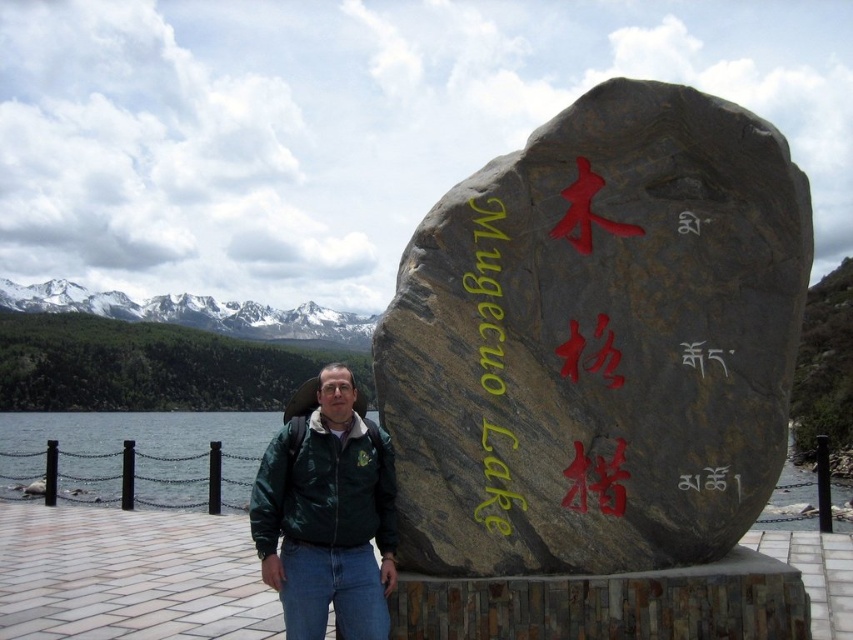
You are a photographer aiming to capture the man in the green matte jacket at center and the clear water at dock left in the same frame. Based on their positions, which object should you focus on first to ensure both are in the shot?

You should focus on the clear water at dock left first because the green matte jacket at center is to the right of it, ensuring both are included in the frame.

You are planning to throw a pebble from the green matte jacket at center towards the clear water at dock left. Given that the jacket is 616.95 feet away from the water, is this distance within a reasonable throwing range for an average adult?

The distance between the green matte jacket at center and the clear water at dock left is 616.95 feet. An average adult can throw a pebble approximately up to 100 feet. Therefore, it is not possible to reach the clear water at dock left from the green matte jacket at center with a single throw.

You are a hiker who wants to take a photo of the clear water at lake right while wearing the green matte jacket at center. Can you wear the jacket and still have the jacket fully visible in the photo?

The green matte jacket at center is shorter than clear water at lake right, so if you wear the jacket, the jacket will be shorter than the water in the photo, meaning the jacket will be fully visible as it does not extend beyond the water level.